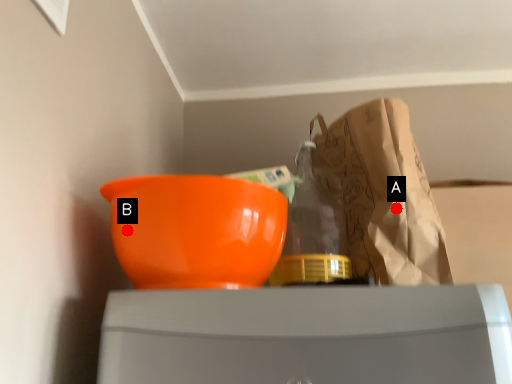
Question: Two points are circled on the image, labeled by A and B beside each circle. Among these points, which one is nearest to the camera?

Choices:
 (A) A is closer
 (B) B is closer

Answer: (B)